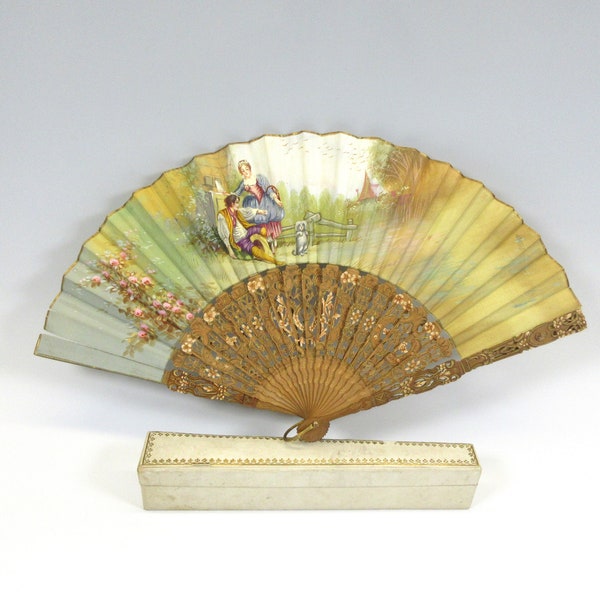
The height and width of the screenshot is (600, 600). I want to click on gold fan decoration, so click(x=168, y=385), click(x=231, y=384), click(x=273, y=355), click(x=291, y=298), click(x=363, y=285), click(x=417, y=325), click(x=366, y=373), click(x=430, y=383), click(x=538, y=333).